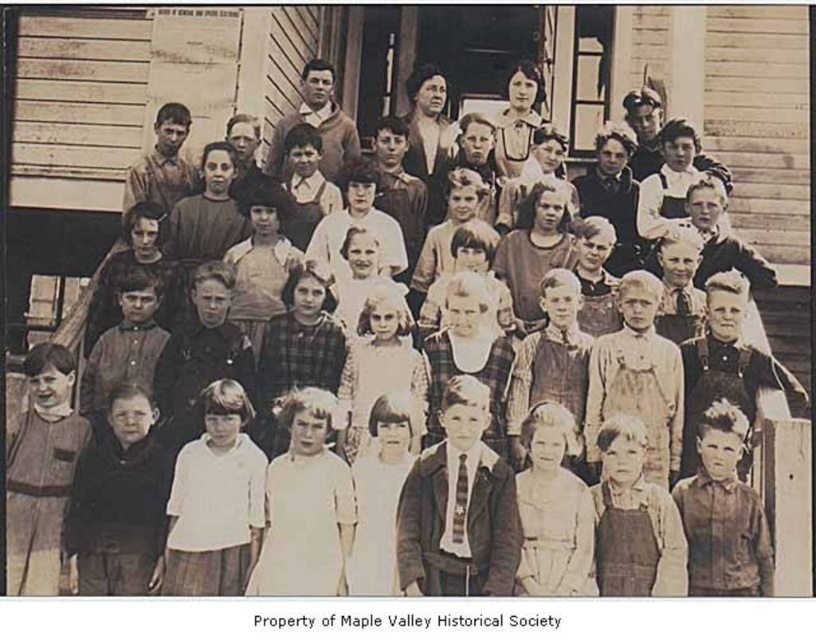
Is smooth brown shirt at center above matte white blouse at center?

Yes, smooth brown shirt at center is above matte white blouse at center.

Who is taller, smooth brown shirt at center or matte white blouse at center?

smooth brown shirt at center

Measure the distance between point (320, 161) and camera.

The distance of point (320, 161) from camera is 67.33 meters.

Locate an element on the screen. smooth brown shirt at center is located at coordinates (317, 124).

Is matte brown dress at center smaller than smooth brown shirt at center?

No.

You are a GUI agent. You are given a task and a screenshot of the screen. Output one action in this format:
    pyautogui.click(x=<x>, y=<y>)
    Task: Click on the matte brown dress at center
    
    Given the screenshot: What is the action you would take?
    pyautogui.click(x=429, y=136)

Does point (432, 216) come farther from viewer compared to point (327, 113)?

No, (432, 216) is closer to viewer.

In order to click on matte brown dress at center in this screenshot , I will do `click(429, 136)`.

Which is in front, point (438, 163) or point (517, 92)?

Point (438, 163)

Looking at this image, is matte brown dress at center to the left of matte white blouse at center from the viewer's perspective?

Yes, matte brown dress at center is to the left of matte white blouse at center.

Locate an element on the screen. This screenshot has height=640, width=816. matte brown dress at center is located at coordinates (429, 136).